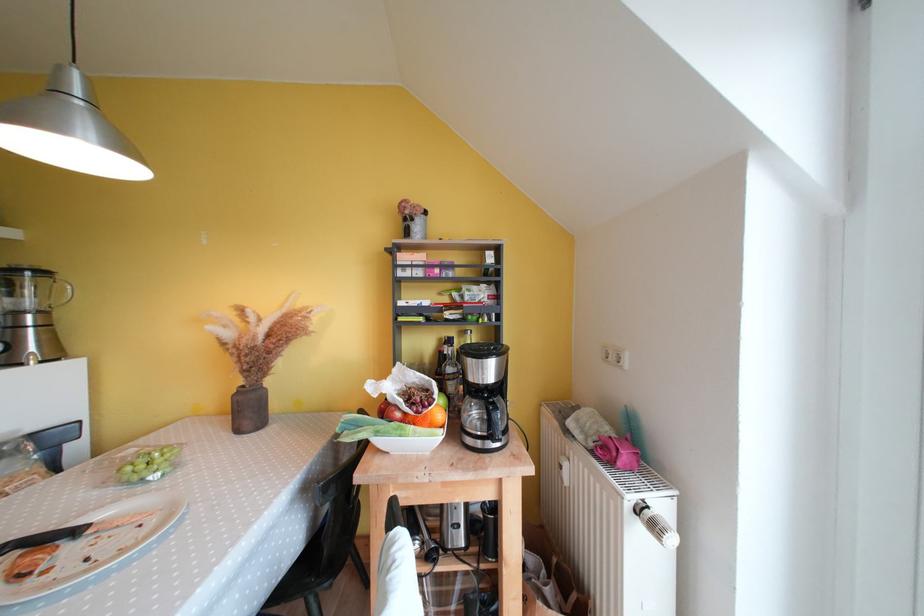
Where is `chair sitting surface`? The width and height of the screenshot is (924, 616). chair sitting surface is located at coordinates (304, 564).